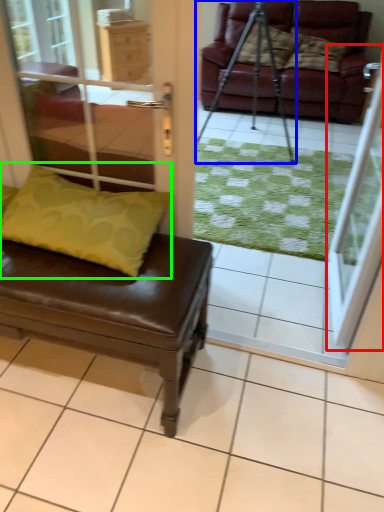
Question: Considering the real-world distances, which object is farthest from screen door (highlighted by a red box)? tripod (highlighted by a blue box) or pillow (highlighted by a green box)?

Choices:
 (A) tripod
 (B) pillow

Answer: (A)